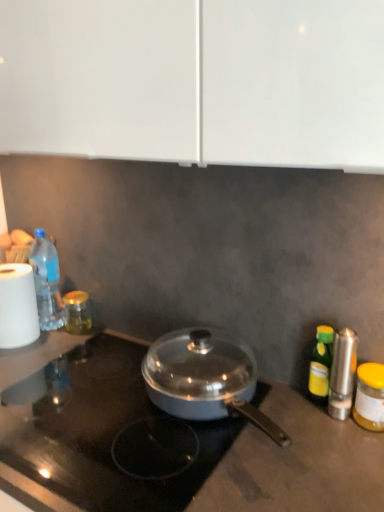
Where is `vacant area that is situated to the right of gold glass jar at left, the 4th bottle from the front`? This screenshot has height=512, width=384. vacant area that is situated to the right of gold glass jar at left, the 4th bottle from the front is located at coordinates (116, 339).